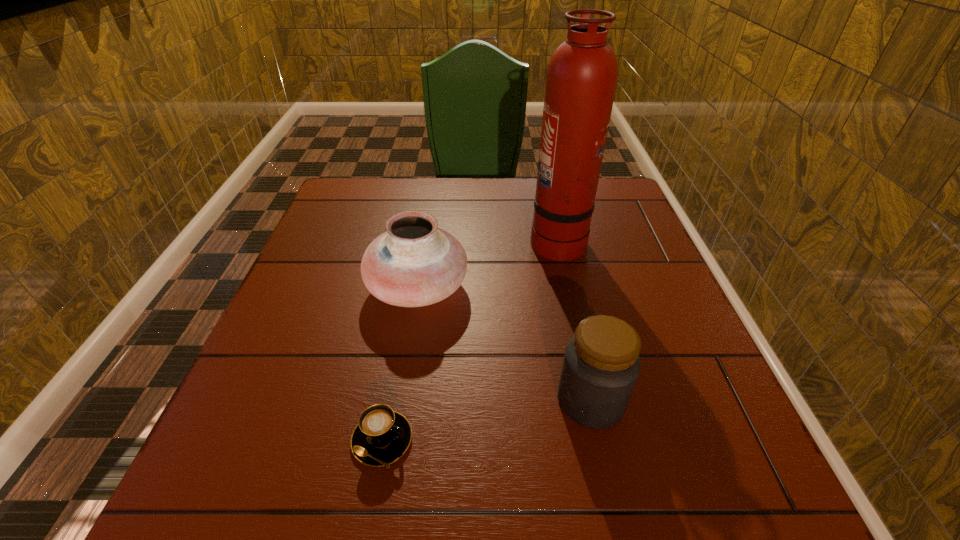
I want to click on vacant area that lies between the pottery and the tallest object, so click(488, 263).

Where is `free space between the shortest object and the fire extinguisher`? The image size is (960, 540). free space between the shortest object and the fire extinguisher is located at coordinates (469, 339).

The image size is (960, 540). I want to click on free space between the cappuccino and the jar, so click(487, 420).

You are a GUI agent. You are given a task and a screenshot of the screen. Output one action in this format:
    pyautogui.click(x=<x>, y=<y>)
    Task: Click on the free spot between the tallest object and the jar
    
    Given the screenshot: What is the action you would take?
    [574, 319]

Image resolution: width=960 pixels, height=540 pixels. In order to click on vacant area that lies between the tallest object and the jar in this screenshot , I will do `click(574, 319)`.

You are a GUI agent. You are given a task and a screenshot of the screen. Output one action in this format:
    pyautogui.click(x=<x>, y=<y>)
    Task: Click on the free space between the pottery and the fire extinguisher
    This screenshot has width=960, height=540.
    Given the screenshot: What is the action you would take?
    tap(488, 263)

Where is `vacant point located between the jar and the fire extinguisher`? Image resolution: width=960 pixels, height=540 pixels. vacant point located between the jar and the fire extinguisher is located at coordinates (574, 319).

Locate an element on the screen. The image size is (960, 540). vacant space that's between the cappuccino and the jar is located at coordinates tap(487, 420).

Identify the location of free space that is in between the jar and the pottery. This screenshot has height=540, width=960. (504, 344).

The width and height of the screenshot is (960, 540). I want to click on vacant area that lies between the pottery and the jar, so click(x=504, y=344).